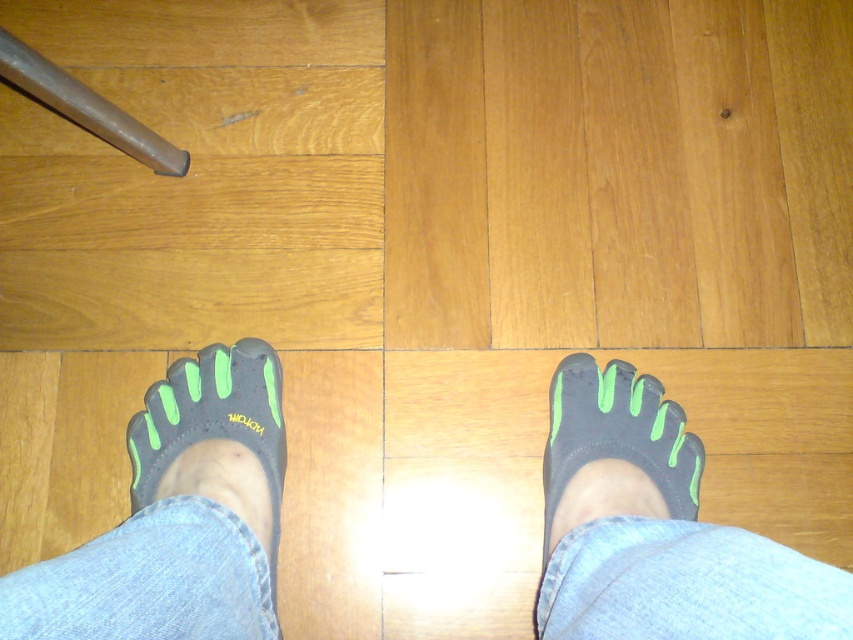
Question: Can you confirm if matte black toe separator at lower center is wider than matte black toe shoe at lower left?

Choices:
 (A) no
 (B) yes

Answer: (A)

Question: Does matte black toe separator at lower center have a greater width compared to matte black toe shoe at lower left?

Choices:
 (A) yes
 (B) no

Answer: (B)

Question: Which object appears closest to the camera in this image?

Choices:
 (A) matte black toe shoe at lower left
 (B) matte black toe separator at lower center

Answer: (A)

Question: Which of these objects is positioned farthest from the matte black toe separator at lower center?

Choices:
 (A) matte black toe shoe at lower left
 (B) black rubber toe socks at center

Answer: (A)

Question: Which point is closer to the camera?

Choices:
 (A) matte black toe shoe at lower left
 (B) matte black toe separator at lower center
 (C) black rubber toe socks at center

Answer: (C)

Question: Does black rubber toe socks at center have a lesser width compared to matte black toe separator at lower center?

Choices:
 (A) no
 (B) yes

Answer: (A)